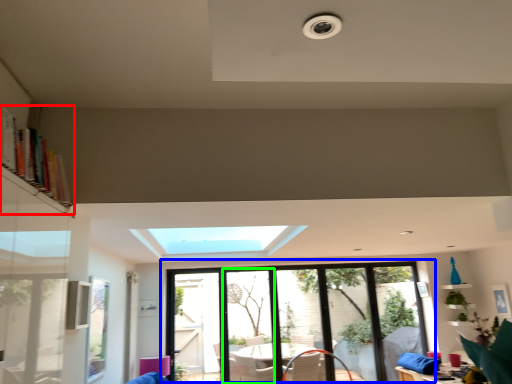
Question: Considering the real-world distances, which object is closest to bookshelf (highlighted by a red box)? window (highlighted by a blue box) or screen door (highlighted by a green box).

Choices:
 (A) window
 (B) screen door

Answer: (A)